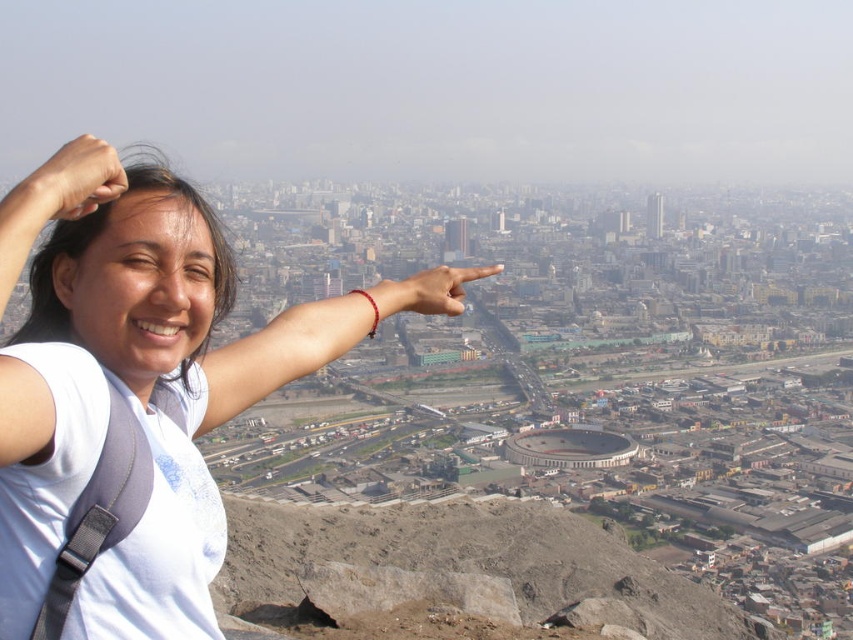
Does white matte shirt at upper left appear under matte skin hand at center?

Yes.

Can you confirm if white matte shirt at upper left is smaller than matte skin hand at center?

Incorrect, white matte shirt at upper left is not smaller in size than matte skin hand at center.

Where is `white matte shirt at upper left`? white matte shirt at upper left is located at coordinates (136, 410).

Who is more forward, (666,611) or (114,161)?

Positioned in front is point (114,161).

How far apart are dull gray rock at center and matte skin hand at upper left?

A distance of 961.63 feet exists between dull gray rock at center and matte skin hand at upper left.

Is point (447, 506) positioned in front of point (93, 170)?

No, (447, 506) is behind (93, 170).

Image resolution: width=853 pixels, height=640 pixels. What are the coordinates of `dull gray rock at center` in the screenshot? It's located at (468, 557).

Between white matte shirt at upper left and dull gray rock at center, which one appears on the left side from the viewer's perspective?

white matte shirt at upper left

Between point (3, 561) and point (419, 529), which one is positioned behind?

Positioned behind is point (419, 529).

Locate an element on the screen. white matte shirt at upper left is located at coordinates (136, 410).